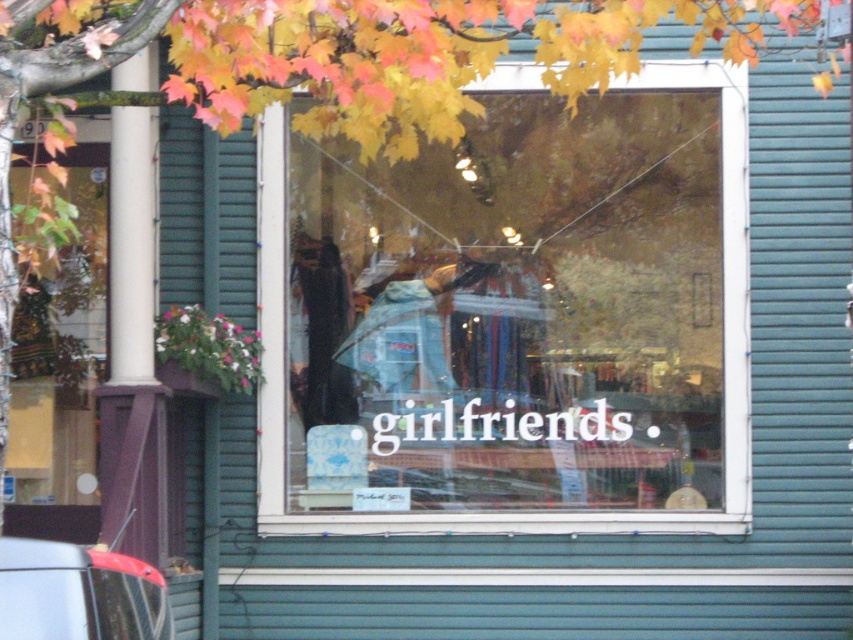
Is transparent glass window at center to the left of metallic gray car at lower left from the viewer's perspective?

Incorrect, transparent glass window at center is not on the left side of metallic gray car at lower left.

Is the position of transparent glass window at center more distant than that of metallic gray car at lower left?

Yes, it is behind metallic gray car at lower left.

Which is behind, point (691, 490) or point (163, 582)?

The point (691, 490) is more distant.

I want to click on transparent glass window at center, so click(514, 317).